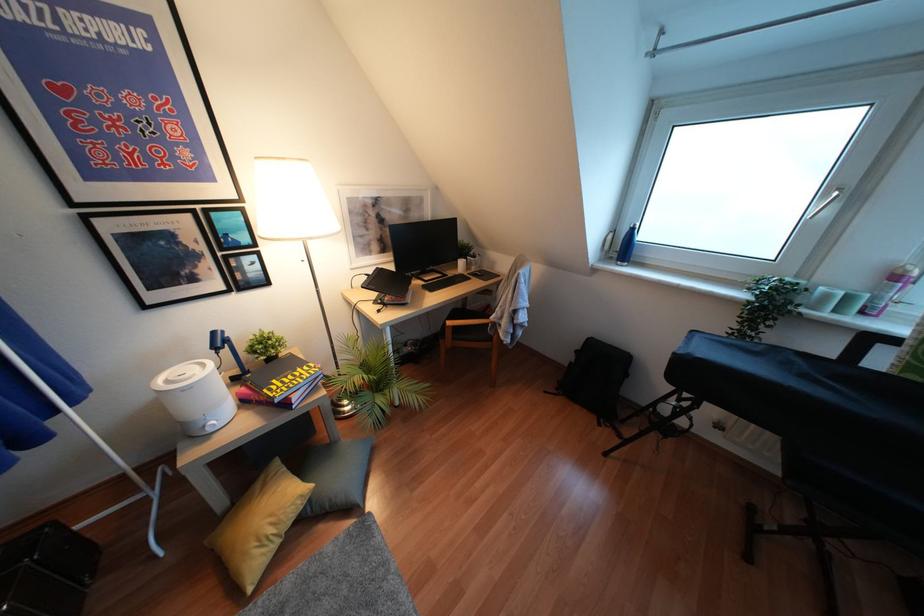
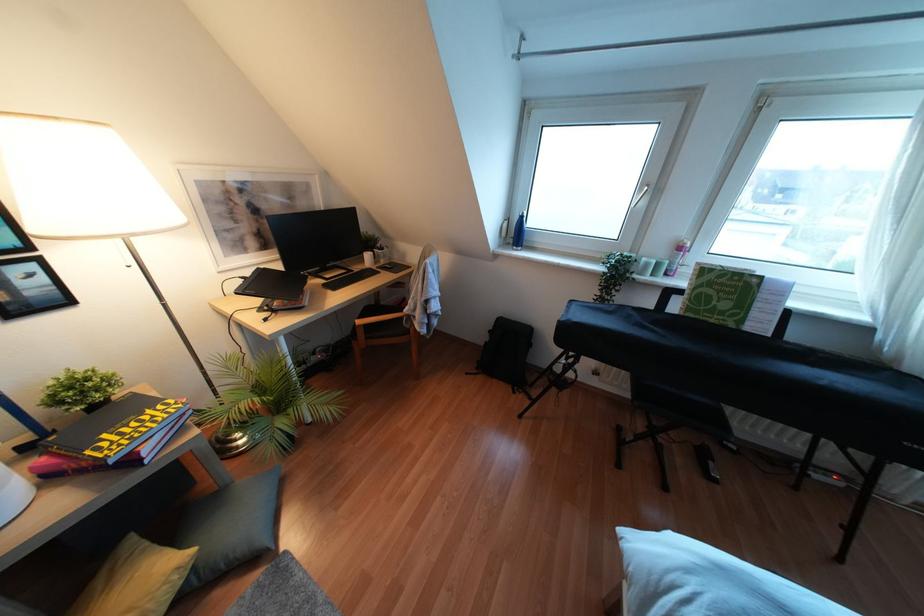
Question: In a continuous first-person perspective shot, in which direction is the camera moving?

Choices:
 (A) Left
 (B) Right
 (C) Forward
 (D) Backward

Answer: (B)